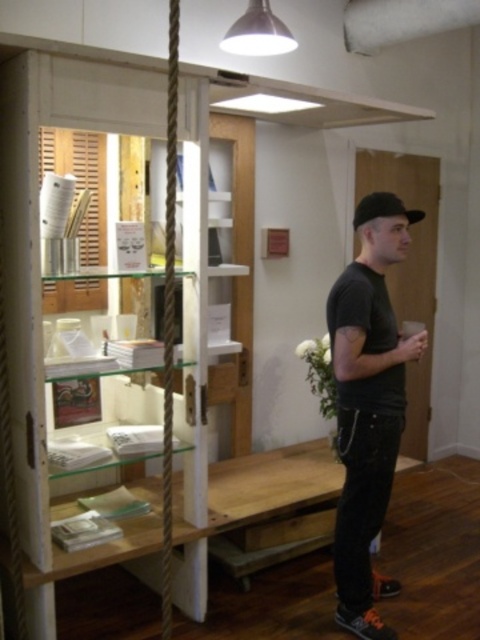
Between point (264, 20) and point (393, 216), which one is positioned behind?

The point (264, 20) is more distant.

Can you confirm if metallic silver lampshade at upper center is bigger than black matte baseball hat at upper right?

Yes.

Describe the element at coordinates (257, 33) in the screenshot. The height and width of the screenshot is (640, 480). I see `metallic silver lampshade at upper center` at that location.

Locate an element on the screen. The height and width of the screenshot is (640, 480). metallic silver lampshade at upper center is located at coordinates (257, 33).

Can you confirm if clear glass shelves at center is thinner than black matte baseball hat at upper right?

No.

Is point (153, 84) positioned in front of point (359, 225)?

Yes, point (153, 84) is in front of point (359, 225).

The image size is (480, 640). I want to click on clear glass shelves at center, so click(36, 205).

Is black matte t-shirt at center to the left of black matte baseball hat at upper right from the viewer's perspective?

Indeed, black matte t-shirt at center is positioned on the left side of black matte baseball hat at upper right.

Who is taller, black matte t-shirt at center or black matte baseball hat at upper right?

Standing taller between the two is black matte t-shirt at center.

Who is more forward, (369, 211) or (363, 220)?

Positioned in front is point (369, 211).

Where is `black matte t-shirt at center`? The height and width of the screenshot is (640, 480). black matte t-shirt at center is located at coordinates (369, 404).